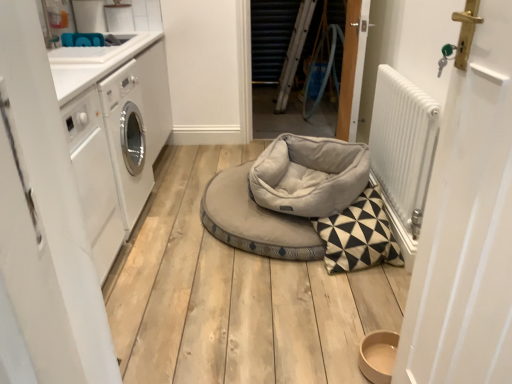
Question: Considering the positions of point (346, 39) and point (15, 211), is point (346, 39) closer or farther from the camera than point (15, 211)?

Choices:
 (A) closer
 (B) farther

Answer: (B)

Question: In terms of height, does wooden door at center, which is the third door in front-to-back order, look taller or shorter compared to white matte door at left, acting as the 3th door starting from the back?

Choices:
 (A) short
 (B) tall

Answer: (B)

Question: Estimate the real-world distances between objects in this image. Which object is closer to the white textured door at right, which appears as the 3th door when viewed from the left?

Choices:
 (A) white glossy washing machine at left
 (B) white matte door at left, acting as the 3th door starting from the back
 (C) soft gray fabric dog bed at center, placed as the 1th dog bed when sorted from front to back
 (D) light gray fabric dog bed at center, the second dog bed from the front
 (E) white metallic radiator at right

Answer: (B)

Question: Which is nearer to the white metallic radiator at right?

Choices:
 (A) white textured door at right, the 1th door viewed from the front
 (B) wooden door at center, arranged as the 2th door when viewed from the left
 (C) white glossy countertop at upper left
 (D) wooden door at center, which is the third door in front-to-back order
 (E) soft gray fabric dog bed at center, placed as the 1th dog bed when sorted from front to back

Answer: (E)